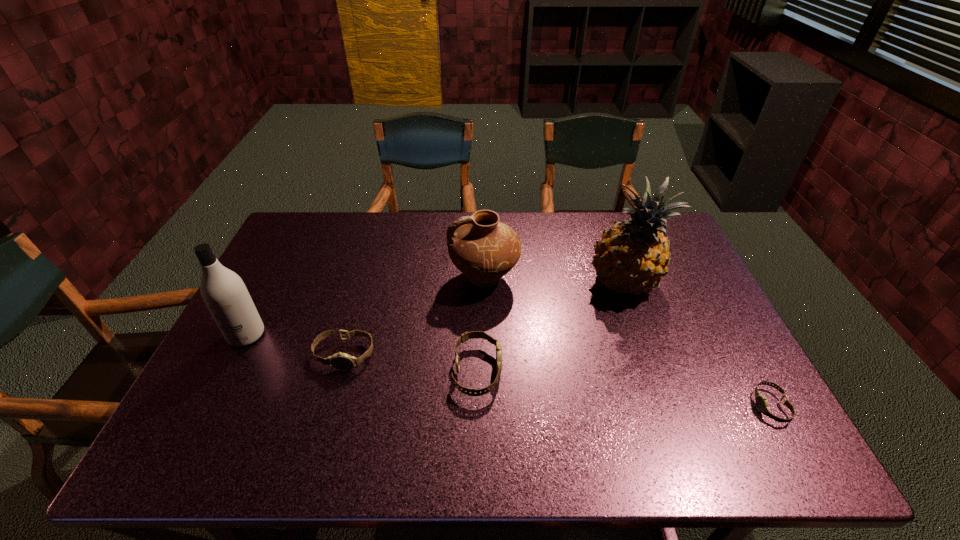
Find the location of `vacant space in between the pottery and the second object from left to right`. vacant space in between the pottery and the second object from left to right is located at coordinates (415, 316).

You are a GUI agent. You are given a task and a screenshot of the screen. Output one action in this format:
    pyautogui.click(x=<x>, y=<y>)
    Task: Click on the vacant area that lies between the second watch from left to right and the fifth object from right to left
    
    Given the screenshot: What is the action you would take?
    pyautogui.click(x=411, y=363)

This screenshot has height=540, width=960. I want to click on free space between the second tallest object and the second watch from right to left, so click(362, 353).

What are the coordinates of `vacant area that lies between the second watch from left to right and the pottery` in the screenshot? It's located at (481, 325).

Where is `vacant point located between the third tallest object and the pineapple`? vacant point located between the third tallest object and the pineapple is located at coordinates 554,280.

Find the location of a particular element. free space between the pineapple and the second watch from left to right is located at coordinates [x=550, y=327].

You are a GUI agent. You are given a task and a screenshot of the screen. Output one action in this format:
    pyautogui.click(x=<x>, y=<y>)
    Task: Click on the vacant space that is in between the shortest watch and the pineapple
    This screenshot has height=540, width=960.
    Given the screenshot: What is the action you would take?
    [696, 345]

Where is `vacant space in between the leftmost watch and the rightmost watch`? Image resolution: width=960 pixels, height=540 pixels. vacant space in between the leftmost watch and the rightmost watch is located at coordinates (558, 381).

The height and width of the screenshot is (540, 960). Identify the location of free space between the second object from right to left and the fourth shortest object. (554, 280).

Find the location of a particular element. The height and width of the screenshot is (540, 960). object that stands as the third closest to the fourth shortest object is located at coordinates (341, 361).